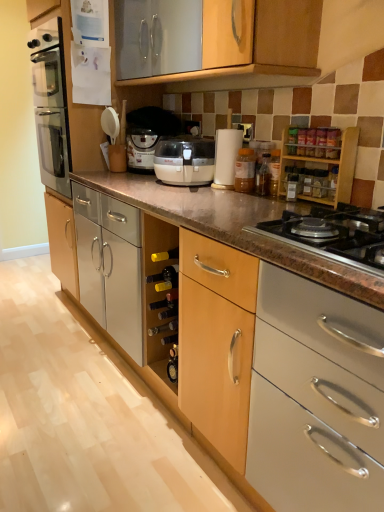
Question: Does wooden spice rack at upper right, the first cabinetry from the right, contain matte white coffee machine at center?

Choices:
 (A) no
 (B) yes

Answer: (A)

Question: Is wooden spice rack at upper right, the second cabinetry positioned from the left, positioned with its back to matte white coffee machine at center?

Choices:
 (A) yes
 (B) no

Answer: (B)

Question: From the image's perspective, would you say wooden spice rack at upper right, arranged as the second cabinetry when viewed from the front, is shown under matte white coffee machine at center?

Choices:
 (A) yes
 (B) no

Answer: (A)

Question: Does wooden spice rack at upper right, the first cabinetry from the right, appear on the left side of matte white coffee machine at center?

Choices:
 (A) yes
 (B) no

Answer: (B)

Question: Is wooden spice rack at upper right, positioned as the 1th cabinetry in back-to-front order, not within matte white coffee machine at center?

Choices:
 (A) no
 (B) yes

Answer: (B)

Question: Looking at their shapes, would you say wooden spice rack at upper right, arranged as the second cabinetry when viewed from the front, is wider or thinner than translucent plastic jar at center?

Choices:
 (A) thin
 (B) wide

Answer: (B)

Question: Choose the correct answer: Is wooden spice rack at upper right, the first cabinetry from the right, inside translucent plastic jar at center or outside it?

Choices:
 (A) inside
 (B) outside

Answer: (B)

Question: From a real-world perspective, relative to translucent plastic jar at center, is wooden spice rack at upper right, arranged as the second cabinetry when viewed from the front, vertically above or below?

Choices:
 (A) above
 (B) below

Answer: (A)

Question: Considering the positions of wooden spice rack at upper right, the first cabinetry from the right, and translucent plastic jar at center in the image, is wooden spice rack at upper right, the first cabinetry from the right, bigger or smaller than translucent plastic jar at center?

Choices:
 (A) big
 (B) small

Answer: (A)

Question: Is wooden cabinet at lower center, which is the 2th cabinetry from back to front, inside the boundaries of matte white coffee machine at center, or outside?

Choices:
 (A) inside
 (B) outside

Answer: (B)

Question: Considering their positions, is wooden cabinet at lower center, positioned as the first cabinetry in bottom-to-top order, located in front of or behind matte white coffee machine at center?

Choices:
 (A) behind
 (B) front

Answer: (B)

Question: Is point [x=291, y=314] positioned closer to the camera than point [x=140, y=123]?

Choices:
 (A) closer
 (B) farther

Answer: (A)

Question: From the image's perspective, is wooden cabinet at lower center, which is counted as the 1th cabinetry, starting from the front, located above or below matte white coffee machine at center?

Choices:
 (A) above
 (B) below

Answer: (B)

Question: Do you think matte white coffee machine at center is within black granite gas stove at lower right, or outside of it?

Choices:
 (A) outside
 (B) inside

Answer: (A)

Question: In the image, is matte white coffee machine at center on the left side or the right side of black granite gas stove at lower right?

Choices:
 (A) right
 (B) left

Answer: (B)